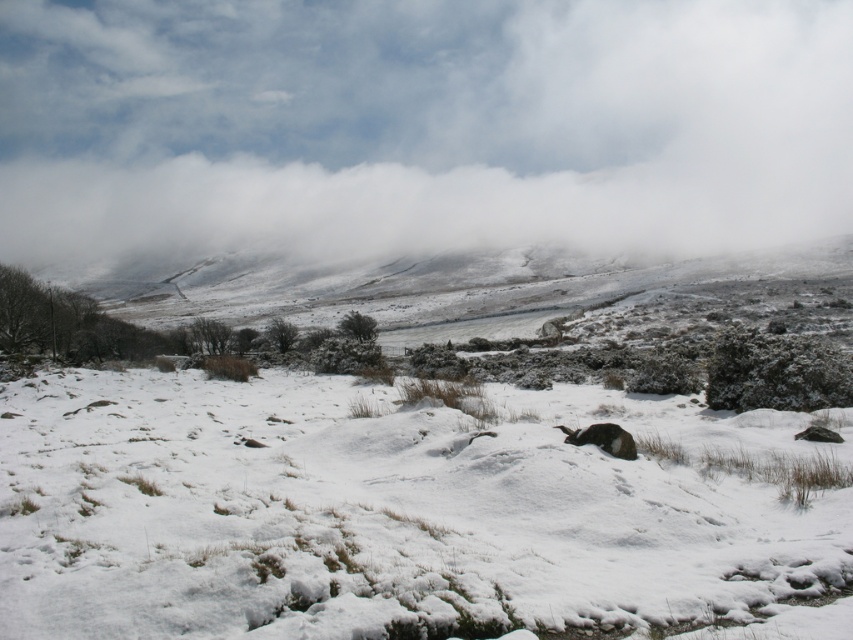
Who is shorter, snowy grass at center or white fluffy cloud at upper center?

Standing shorter between the two is snowy grass at center.

Is snowy grass at center positioned before white fluffy cloud at upper center?

Yes, it is.

Is point (605, 307) farther from camera compared to point (625, 118)?

No, it is not.

This screenshot has height=640, width=853. Find the location of `snowy grass at center`. snowy grass at center is located at coordinates (405, 512).

Between snowy grass at center and furry black animal at center, which one is positioned higher?

snowy grass at center

Does snowy grass at center have a lesser height compared to furry black animal at center?

Incorrect, snowy grass at center's height does not fall short of furry black animal at center's.

At what (x,y) coordinates should I click in order to perform the action: click on snowy grass at center. Please return your answer as a coordinate pair (x, y). The width and height of the screenshot is (853, 640). Looking at the image, I should click on (405, 512).

The image size is (853, 640). Identify the location of snowy grass at center. (405, 512).

Who is shorter, white fluffy cloud at upper center or furry black animal at center?

Standing shorter between the two is furry black animal at center.

Does point (144, 145) lie in front of point (612, 435)?

No, (144, 145) is further to viewer.

Identify the location of white fluffy cloud at upper center. The width and height of the screenshot is (853, 640). (421, 128).